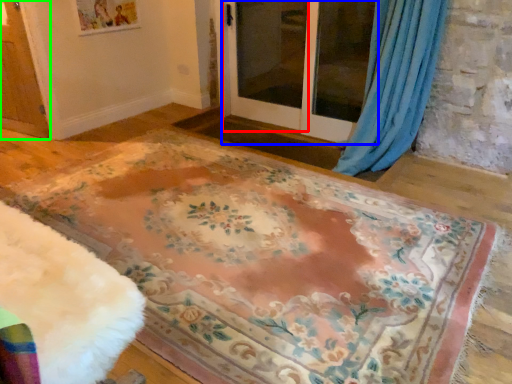
Question: Which object is the farthest from screen door (highlighted by a red box)? Choose among these: screen door (highlighted by a blue box) or screen door (highlighted by a green box).

Choices:
 (A) screen door
 (B) screen door

Answer: (B)